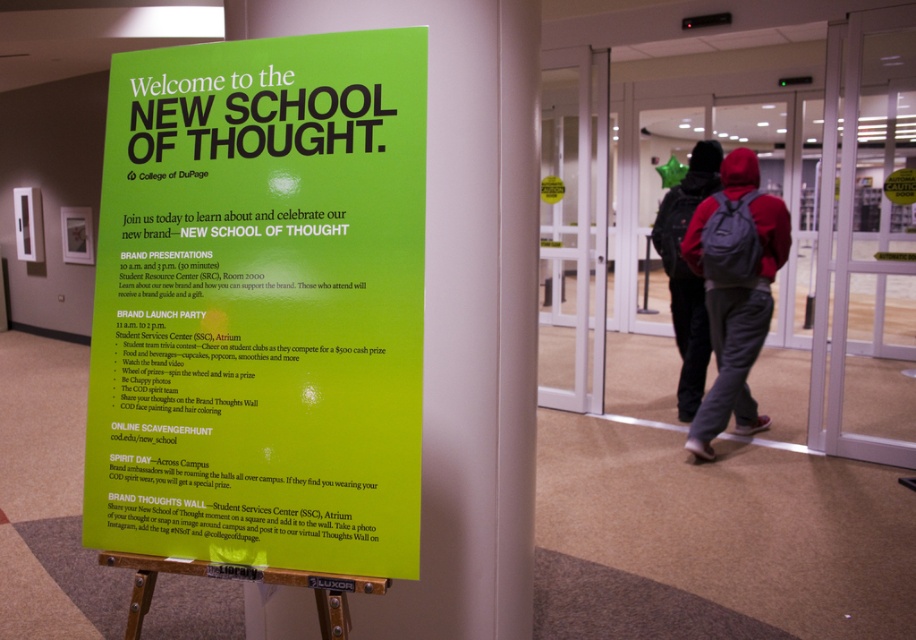
Between red fleece hoodie at center and dark gray backpack at center, which one appears on the right side from the viewer's perspective?

Positioned to the right is red fleece hoodie at center.

I want to click on red fleece hoodie at center, so click(x=735, y=300).

Which is in front, point (751, 269) or point (675, 332)?

Positioned in front is point (751, 269).

The image size is (916, 640). I want to click on red fleece hoodie at center, so click(x=735, y=300).

Does green paper sign at center have a lesser height compared to red fleece hoodie at center?

Yes.

Is green paper sign at center taller than red fleece hoodie at center?

No, green paper sign at center is not taller than red fleece hoodie at center.

What do you see at coordinates (260, 305) in the screenshot? I see `green paper sign at center` at bounding box center [260, 305].

Where is `green paper sign at center`? Image resolution: width=916 pixels, height=640 pixels. green paper sign at center is located at coordinates (260, 305).

Is green paper sign at center thinner than dark gray backpack at center?

Incorrect, green paper sign at center's width is not less than dark gray backpack at center's.

Who is taller, green paper sign at center or dark gray backpack at center?

Standing taller between the two is dark gray backpack at center.

Does point (89, 420) lie in front of point (693, 193)?

Yes.

Where is `green paper sign at center`? The image size is (916, 640). green paper sign at center is located at coordinates (260, 305).